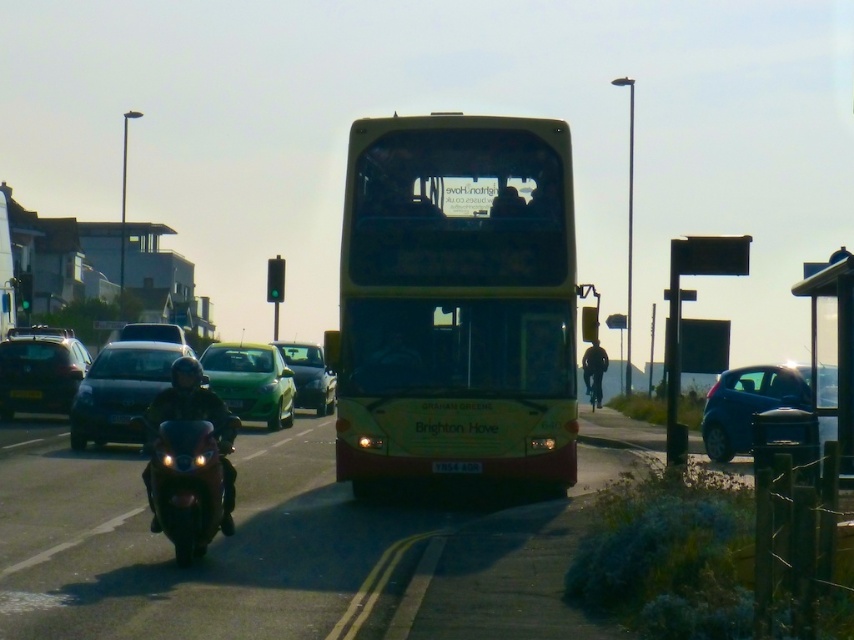
You are a pedestrian standing on the sidewalk and want to cross the street. You see a matte black car at left and a metallic sign at right. Which object is closer to you?

The matte black car at left is closer to you because the metallic sign at right is behind it.

You are a delivery person who needs to load a package onto the roof of the metallic green car at center. The package is 1.2 meters tall. Can you safely place it there without exceeding the height limit imposed by the yellow matte license plate at center?

The metallic green car at center has a lesser height compared to the yellow matte license plate at center, meaning the license plate is taller. However, the height of the license plate itself is not specified. Without knowing the exact height of the license plate, it is impossible to determine if the 1.2 meter package will exceed the height limit. Additional measurements are needed to ensure compliance.